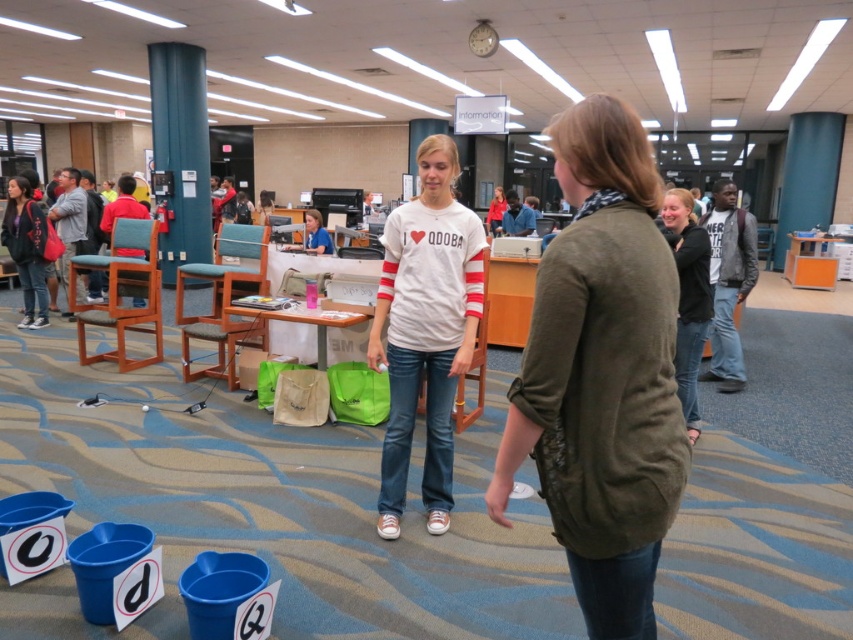
Question: Is white cotton shirt at center thinner than dark gray sweater at center?

Choices:
 (A) no
 (B) yes

Answer: (A)

Question: Among these points, which one is farthest from the camera?

Choices:
 (A) (38, 298)
 (B) (685, 424)
 (C) (527, 348)
 (D) (448, 484)

Answer: (A)

Question: Which object appears farthest from the camera in this image?

Choices:
 (A) white cotton shirt at center
 (B) olive green sweater at center

Answer: (A)

Question: Can you confirm if olive green sweater at center is positioned above matte black jacket at left?

Choices:
 (A) no
 (B) yes

Answer: (A)

Question: Which point is farther to the camera?

Choices:
 (A) white cotton shirt at center
 (B) matte black jacket at left
 (C) olive green sweater at center

Answer: (B)

Question: Is white cotton shirt at center to the right of matte black jacket at left from the viewer's perspective?

Choices:
 (A) no
 (B) yes

Answer: (B)